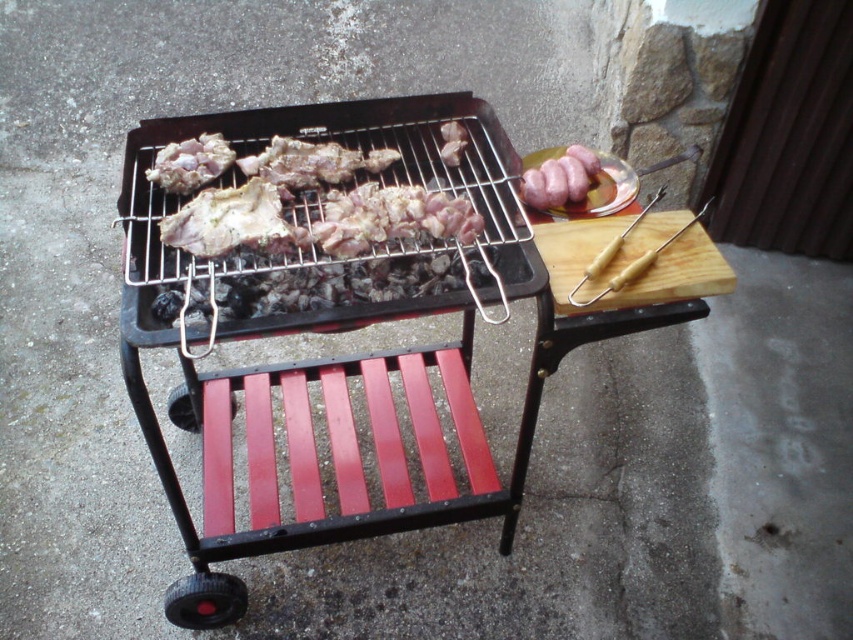
Which is above, black metal grill at center or brown meaty bone at center?

brown meaty bone at center is higher up.

Between point (154, 125) and point (268, 224), which one is positioned in front?

Point (268, 224) is more forward.

At what (x,y) coordinates should I click in order to perform the action: click on black metal grill at center. Please return your answer as a coordinate pair (x, y). The width and height of the screenshot is (853, 640). Looking at the image, I should click on (344, 358).

This screenshot has height=640, width=853. What are the coordinates of `black metal grill at center` in the screenshot? It's located at (344, 358).

Which is more to the right, grilled meat at center or brown meaty bone at center?

grilled meat at center

Which of these two, grilled meat at center or brown meaty bone at center, stands taller?

grilled meat at center

Is point (242, 234) positioned before point (254, 204)?

Yes, it is in front of point (254, 204).

Where is `grilled meat at center`? The image size is (853, 640). grilled meat at center is located at coordinates (318, 209).

Is pink glossy sausages at upper right taller than white meat at center?

Yes, pink glossy sausages at upper right is taller than white meat at center.

Does pink glossy sausages at upper right have a larger size compared to white meat at center?

→ Indeed, pink glossy sausages at upper right has a larger size compared to white meat at center.

This screenshot has height=640, width=853. I want to click on pink glossy sausages at upper right, so click(560, 179).

At what (x,y) coordinates should I click in order to perform the action: click on pink glossy sausages at upper right. Please return your answer as a coordinate pair (x, y). The height and width of the screenshot is (640, 853). Looking at the image, I should click on (560, 179).